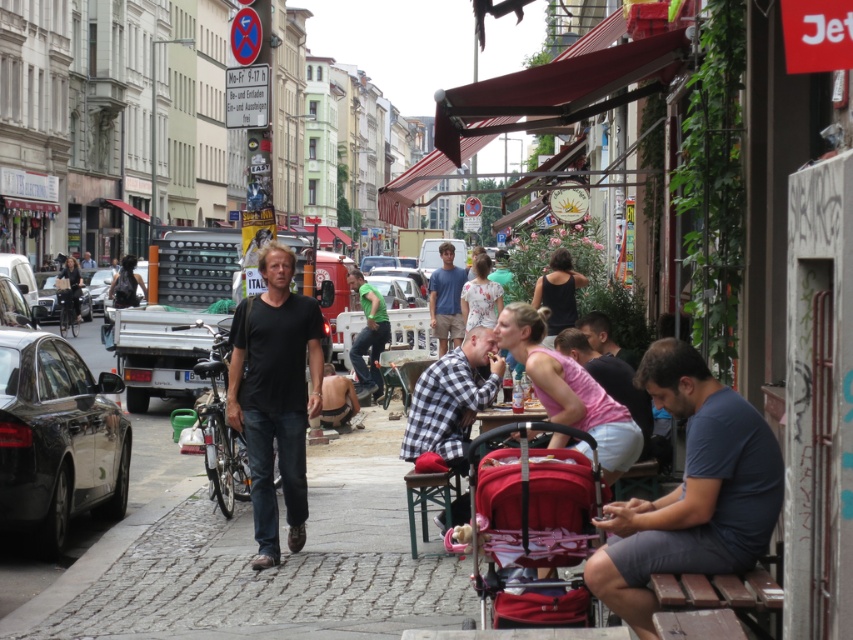
Who is positioned more to the right, dark blue t-shirt at center or dark blue shirt at center?

dark blue shirt at center is more to the right.

How distant is dark blue t-shirt at center from dark blue shirt at center?

They are 4.48 meters apart.

Is point (775, 508) more distant than point (627, 371)?

That is False.

Identify the location of dark blue t-shirt at center. This screenshot has width=853, height=640. (691, 490).

Does checkered fabric shirt at center have a greater width compared to green matte shirt at center?

Yes.

Who is more distant from viewer, (421, 404) or (386, 337)?

The point (386, 337) is more distant.

Find the location of a particular element. checkered fabric shirt at center is located at coordinates (451, 400).

Can you confirm if shiny black car at left is smaller than green matte shirt at center?

Incorrect, shiny black car at left is not smaller in size than green matte shirt at center.

Is shiny black car at left above green matte shirt at center?

No.

Is point (123, 428) less distant than point (373, 340)?

Yes, point (123, 428) is in front of point (373, 340).

Locate an element on the screen. The width and height of the screenshot is (853, 640). shiny black car at left is located at coordinates (57, 438).